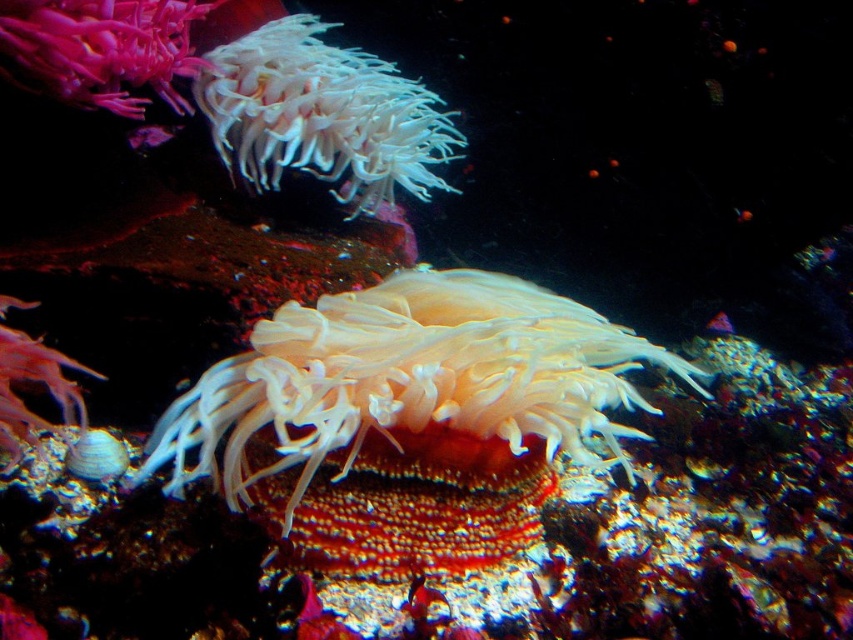
Between translucent white anemone at center and smooth pink coral at upper left, which one is positioned higher?

A: smooth pink coral at upper left is higher up.

Does translucent white anemone at center lie in front of smooth pink coral at upper left?

No, translucent white anemone at center is behind smooth pink coral at upper left.

Is point (463, 381) less distant than point (67, 49)?

No, (463, 381) is further to viewer.

Where is `translucent white anemone at center`? The height and width of the screenshot is (640, 853). translucent white anemone at center is located at coordinates (410, 380).

Is white soft coral at upper center thinner than smooth pink coral at upper left?

No.

Who is taller, white soft coral at upper center or smooth pink coral at upper left?

With more height is white soft coral at upper center.

This screenshot has height=640, width=853. I want to click on white soft coral at upper center, so click(321, 115).

Can you confirm if translucent white anemone at center is shorter than white soft coral at upper center?

No.

Is translucent white anemone at center to the right of white soft coral at upper center from the viewer's perspective?

Yes, translucent white anemone at center is to the right of white soft coral at upper center.

Who is more distant from viewer, (410, 330) or (379, 129)?

The point (379, 129) is behind.

Find the location of `translucent white anemone at center`. translucent white anemone at center is located at coordinates (410, 380).